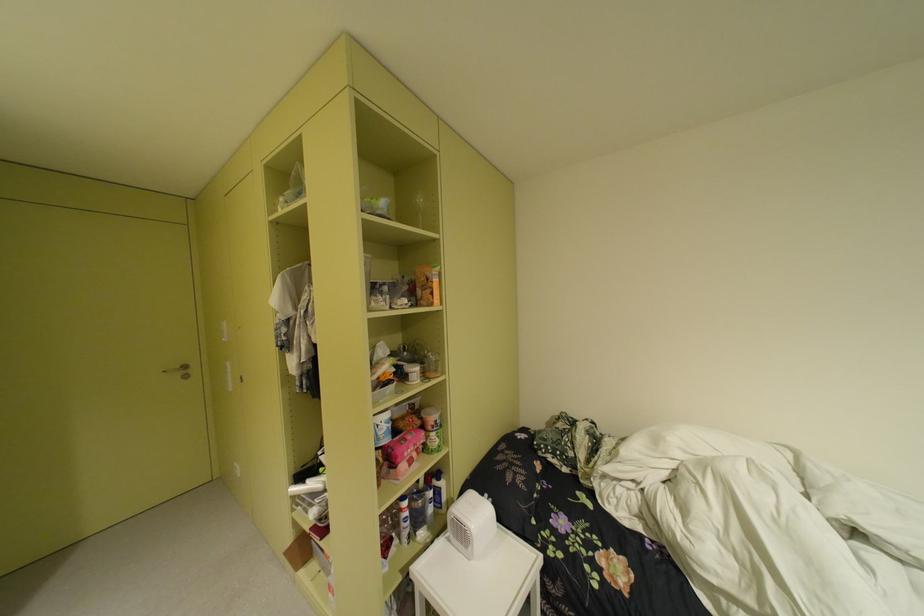
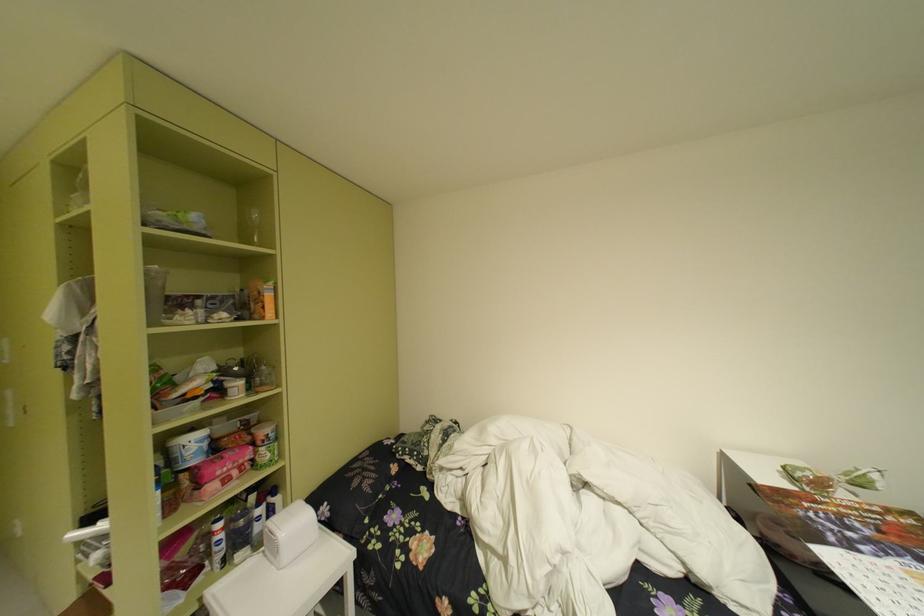
Question: I am providing you with two images of the same scene from different viewpoints. After the viewpoint changes to image2, which objects are now occluded?

Choices:
 (A) blue spray can nozzle
 (B) clear wine glass
 (C) pink food package
 (D) none of these

Answer: (D)